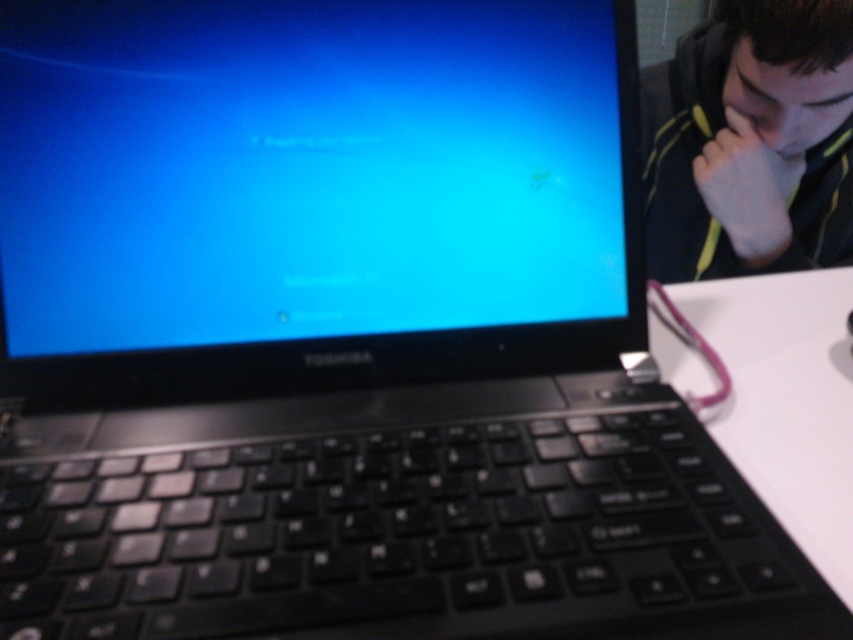
You are trying to take a photo of the blue glossy screen at center and the black fleece jacket at upper right. Which object should you focus on first if you want both to be in clear focus?

The blue glossy screen at center is closer to the viewer than the black fleece jacket at upper right. To ensure both are in clear focus, focus on the closer object first, which is the blue glossy screen at center.

You are setting up a laptop in a dimly lit room. The blue glossy screen at center and the black fleece jacket at upper right are in your view. Which object is closer to the bottom edge of the laptop?

The blue glossy screen at center is located below the black fleece jacket at upper right, so it is closer to the bottom edge of the laptop.

You are looking at the Toshiba laptop screen and keyboard. There are two points marked on the image, one at point (427, 196) and the other at point (648, 305). Which point is closer to you?

Point (427, 196) is in front of point (648, 305), so it is closer to you.